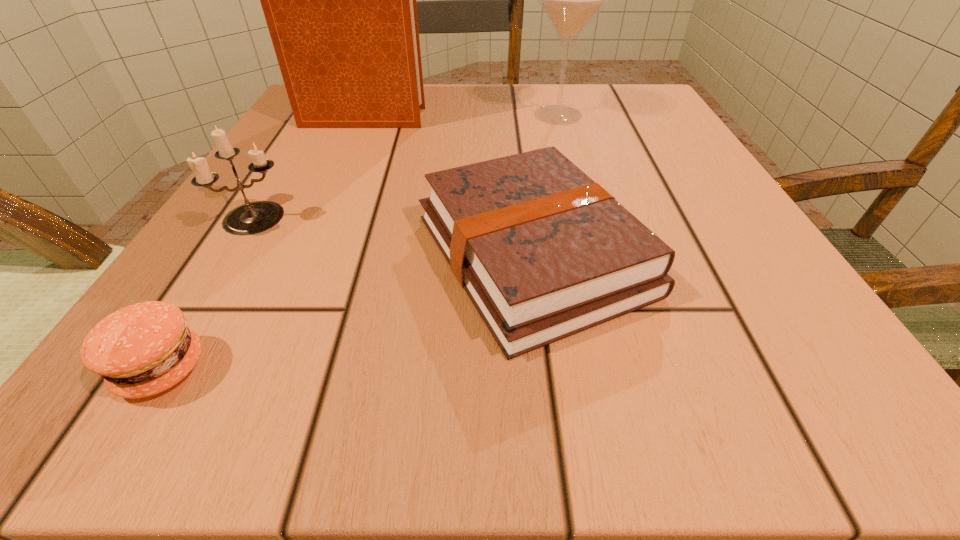
At what (x,y) coordinates should I click in order to perform the action: click on free space at the far right corner. Please return your answer as a coordinate pair (x, y). Image resolution: width=960 pixels, height=540 pixels. Looking at the image, I should click on (607, 113).

I want to click on vacant space in between the candle holder and the patty, so click(x=210, y=293).

Where is `unoccupied area between the second tallest object and the tallest object`? unoccupied area between the second tallest object and the tallest object is located at coordinates (460, 117).

Locate an element on the screen. vacant point located between the candle holder and the martini is located at coordinates (408, 166).

Find the location of `vacant point located between the fourth shortest object and the third tallest object`. vacant point located between the fourth shortest object and the third tallest object is located at coordinates (408, 166).

The width and height of the screenshot is (960, 540). I want to click on free space between the candle holder and the martini, so click(x=408, y=166).

The width and height of the screenshot is (960, 540). Find the location of `free area in between the farther hardback book and the third tallest object`. free area in between the farther hardback book and the third tallest object is located at coordinates (309, 168).

Locate an element on the screen. This screenshot has height=540, width=960. object that is the fourth nearest to the patty is located at coordinates (570, 0).

Identify which object is the second closest to the farther hardback book. Please provide its 2D coordinates. Your answer should be formatted as a tuple, i.e. [(x, y)], where the tuple contains the x and y coordinates of a point satisfying the conditions above.

[(543, 252)]

Locate an element on the screen. The image size is (960, 540). vacant area in the image that satisfies the following two spatial constraints: 1. on the back side of the shorter hardback book; 2. on the open cover of the left hardback book is located at coordinates (516, 118).